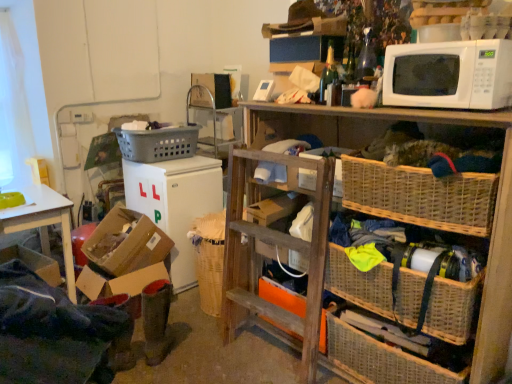
Identify the location of green felt boots at lower left. (156, 320).

Locate an element on the screen. Image resolution: width=512 pixels, height=384 pixels. woven wicker picnic basket at lower right, the 1th picnic basket when ordered from bottom to top is located at coordinates (381, 359).

What is the approximate height of cardboard box at lower left, arranged as the second box when viewed from the top?

The height of cardboard box at lower left, arranged as the second box when viewed from the top, is 13.67 inches.

Image resolution: width=512 pixels, height=384 pixels. I want to click on white wood desk at lower left, so click(x=44, y=223).

Where is `green felt boots at lower left`? green felt boots at lower left is located at coordinates (156, 320).

Can you confirm if cardboard box at lower left, arranged as the second box when viewed from the top, is shorter than cardboard box at lower left, which is counted as the first box, starting from the top?

Yes, cardboard box at lower left, arranged as the second box when viewed from the top, is shorter than cardboard box at lower left, which is counted as the first box, starting from the top.

Is point (83, 267) closer or farther from the camera than point (166, 249)?

Clearly, point (83, 267) is closer to the camera than point (166, 249).

Looking at their sizes, would you say cardboard box at lower left, arranged as the second box when viewed from the top, is wider or thinner than cardboard box at lower left, the second box from the bottom?

cardboard box at lower left, arranged as the second box when viewed from the top, is wider than cardboard box at lower left, the second box from the bottom.

Does woven wicker basket at lower right have a larger size compared to cardboard box at lower left, which is counted as the first box, starting from the top?

Yes, woven wicker basket at lower right is bigger than cardboard box at lower left, which is counted as the first box, starting from the top.

From the image's perspective, is woven wicker basket at lower right under cardboard box at lower left, the second box from the bottom?

Yes, from the image's perspective, woven wicker basket at lower right is beneath cardboard box at lower left, the second box from the bottom.

Does point (379, 290) appear closer or farther from the camera than point (173, 242)?

Point (379, 290) is positioned closer to the camera compared to point (173, 242).

Choose the correct answer: Is woven wicker picnic basket at lower right, which ranks as the second picnic basket in back-to-front order, inside woven wicker basket at center-right, placed as the 1th picnic basket when sorted from front to back, or outside it?

woven wicker picnic basket at lower right, which ranks as the second picnic basket in back-to-front order, is spatially situated outside woven wicker basket at center-right, placed as the 1th picnic basket when sorted from front to back.

Consider the image. Measure the distance between woven wicker picnic basket at lower right, which ranks as the second picnic basket in back-to-front order, and woven wicker basket at center-right, which is the second picnic basket in right-to-left order.

27.97 inches.

From the image's perspective, relative to woven wicker basket at center-right, which is counted as the second picnic basket, starting from the top, is woven wicker picnic basket at lower right, which ranks as the second picnic basket in back-to-front order, above or below?

woven wicker picnic basket at lower right, which ranks as the second picnic basket in back-to-front order, is situated lower than woven wicker basket at center-right, which is counted as the second picnic basket, starting from the top, in the image.

Can you see woven wicker picnic basket at lower right, which ranks as the 2th picnic basket in front-to-back order, touching woven wicker basket at center-right, arranged as the third picnic basket when viewed from the back?

There is a gap between woven wicker picnic basket at lower right, which ranks as the 2th picnic basket in front-to-back order, and woven wicker basket at center-right, arranged as the third picnic basket when viewed from the back.

Can you tell me how much cardboard box at lower left, arranged as the second box when viewed from the top, and orange cardboard box at center differ in facing direction?

They differ by 5.11 degrees in their facing directions.

Based on the photo, between cardboard box at lower left, arranged as the second box when viewed from the top, and orange cardboard box at center, which one appears on the left side from the viewer's perspective?

From the viewer's perspective, cardboard box at lower left, arranged as the second box when viewed from the top, appears more on the left side.

Looking at this image, is cardboard box at lower left, which appears as the first box when ordered from the bottom, touching orange cardboard box at center?

No, cardboard box at lower left, which appears as the first box when ordered from the bottom, is not touching orange cardboard box at center.

Is woven wicker basket at center-right, arranged as the third picnic basket when viewed from the back, far away from white matte refrigerator at lower left?

Yes, woven wicker basket at center-right, arranged as the third picnic basket when viewed from the back, and white matte refrigerator at lower left are located far from each other.

Which is closer to the camera, (397,169) or (185,270)?

The point (397,169) is in front.

From the image's perspective, is woven wicker basket at center-right, placed as the 1th picnic basket when sorted from front to back, under white matte refrigerator at lower left?

Actually, woven wicker basket at center-right, placed as the 1th picnic basket when sorted from front to back, appears above white matte refrigerator at lower left in the image.

Is woven wicker basket at center-right, arranged as the third picnic basket when viewed from the back, outside of white matte refrigerator at lower left?

woven wicker basket at center-right, arranged as the third picnic basket when viewed from the back, is positioned outside white matte refrigerator at lower left.

Is woven wicker basket at center-right, which is the second picnic basket in right-to-left order, at the left side of gray plastic laundry basket at upper left, the 3th picnic basket when ordered from front to back?

Incorrect, woven wicker basket at center-right, which is the second picnic basket in right-to-left order, is not on the left side of gray plastic laundry basket at upper left, the 3th picnic basket when ordered from front to back.

Which object is wider, woven wicker basket at center-right, placed as the second picnic basket when sorted from bottom to top, or gray plastic laundry basket at upper left, which appears as the first picnic basket when viewed from the back?

Wider between the two is gray plastic laundry basket at upper left, which appears as the first picnic basket when viewed from the back.

Is woven wicker basket at center-right, which is the second picnic basket in right-to-left order, aimed at gray plastic laundry basket at upper left, the 3th picnic basket viewed from the right?

No.

Is point (484, 235) behind point (157, 147)?

No.

Considering the relative sizes of cardboard box at lower left, which is counted as the first box, starting from the top, and cardboard box at lower left, arranged as the second box when viewed from the top, in the image provided, is cardboard box at lower left, which is counted as the first box, starting from the top, taller than cardboard box at lower left, arranged as the second box when viewed from the top,?

Indeed, cardboard box at lower left, which is counted as the first box, starting from the top, has a greater height compared to cardboard box at lower left, arranged as the second box when viewed from the top.

Are cardboard box at lower left, the second box from the bottom, and cardboard box at lower left, arranged as the second box when viewed from the top, beside each other?

No, cardboard box at lower left, the second box from the bottom, is not making contact with cardboard box at lower left, arranged as the second box when viewed from the top.

In terms of width, does cardboard box at lower left, which is counted as the first box, starting from the top, look wider or thinner when compared to cardboard box at lower left, arranged as the second box when viewed from the top?

cardboard box at lower left, which is counted as the first box, starting from the top, is thinner than cardboard box at lower left, arranged as the second box when viewed from the top.

Can you tell me how much cardboard box at lower left, the second box from the bottom, and cardboard box at lower left, arranged as the second box when viewed from the top, differ in facing direction?

The angle between the facing direction of cardboard box at lower left, the second box from the bottom, and the facing direction of cardboard box at lower left, arranged as the second box when viewed from the top, is 1.22 degrees.

This screenshot has height=384, width=512. Find the location of `box located on the left of cardboard box at lower left, which is counted as the first box, starting from the top`. box located on the left of cardboard box at lower left, which is counted as the first box, starting from the top is located at coordinates (121, 284).

Find the location of a particular element. Image resolution: width=512 pixels, height=384 pixels. basket on the right of cardboard box at lower left, which is counted as the first box, starting from the top is located at coordinates (360, 283).

Based on their spatial positions, is woven wood shelf at upper right or woven wicker basket at lower right further from gray plastic laundry basket at upper left, the 3th picnic basket when ordered from front to back?

woven wicker basket at lower right lies further to gray plastic laundry basket at upper left, the 3th picnic basket when ordered from front to back, than the other object.

Considering their positions, is woven wicker basket at lower right positioned further to cardboard box at lower left, which is counted as the first box, starting from the top, than woven wicker basket at center-right, placed as the second picnic basket when sorted from bottom to top?

woven wicker basket at center-right, placed as the second picnic basket when sorted from bottom to top, is further to cardboard box at lower left, which is counted as the first box, starting from the top.

When comparing their distances from white matte refrigerator at lower left, does orange cardboard box at center or woven wicker basket at center-right, which is the 2th picnic basket from left to right, seem closer?

Among the two, orange cardboard box at center is located nearer to white matte refrigerator at lower left.

Which object lies further to the anchor point woven wicker basket at lower right, white wood desk at lower left or orange cardboard box at center?

white wood desk at lower left.

Looking at this image, when comparing their distances from white matte microwave at upper right, does white matte refrigerator at lower left or green glass bottle at upper center seem further?

Among the two, white matte refrigerator at lower left is located further to white matte microwave at upper right.

Estimate the real-world distances between objects in this image. Which object is further from woven wicker picnic basket at lower right, the third picnic basket positioned from the top, cardboard box at lower left, which appears as the first box when ordered from the bottom, or gray plastic laundry basket at upper left, which appears as the first picnic basket when viewed from the back?

gray plastic laundry basket at upper left, which appears as the first picnic basket when viewed from the back, is further to woven wicker picnic basket at lower right, the third picnic basket positioned from the top.

Based on their spatial positions, is cardboard box at lower left, arranged as the second box when viewed from the top, or woven wicker basket at center-right, which is the 2th picnic basket from left to right, closer to orange cardboard box at center?

woven wicker basket at center-right, which is the 2th picnic basket from left to right, is positioned closer to the anchor orange cardboard box at center.

Estimate the real-world distances between objects in this image. Which object is closer to woven wicker basket at center-right, which is the 2th picnic basket from left to right, white matte microwave at upper right or woven wood shelf at upper right?

The object closer to woven wicker basket at center-right, which is the 2th picnic basket from left to right, is woven wood shelf at upper right.

Image resolution: width=512 pixels, height=384 pixels. I want to click on bottle between white matte refrigerator at lower left and white matte microwave at upper right from left to right, so click(x=328, y=76).

Where is `shelf between green glass bottle at upper center and green felt boots at lower left in the vertical direction`? shelf between green glass bottle at upper center and green felt boots at lower left in the vertical direction is located at coordinates (357, 146).

I want to click on picnic basket between gray plastic laundry basket at upper left, the 3th picnic basket viewed from the right, and woven wicker picnic basket at lower right, which is the 1th picnic basket in right-to-left order, in the horizontal direction, so click(x=421, y=196).

At what (x,y) coordinates should I click in order to perform the action: click on storage box between green glass bottle at upper center and woven wicker picnic basket at lower right, the 1th picnic basket when ordered from bottom to top, vertically. Please return your answer as a coordinate pair (x, y). The image size is (512, 384). Looking at the image, I should click on (281, 296).